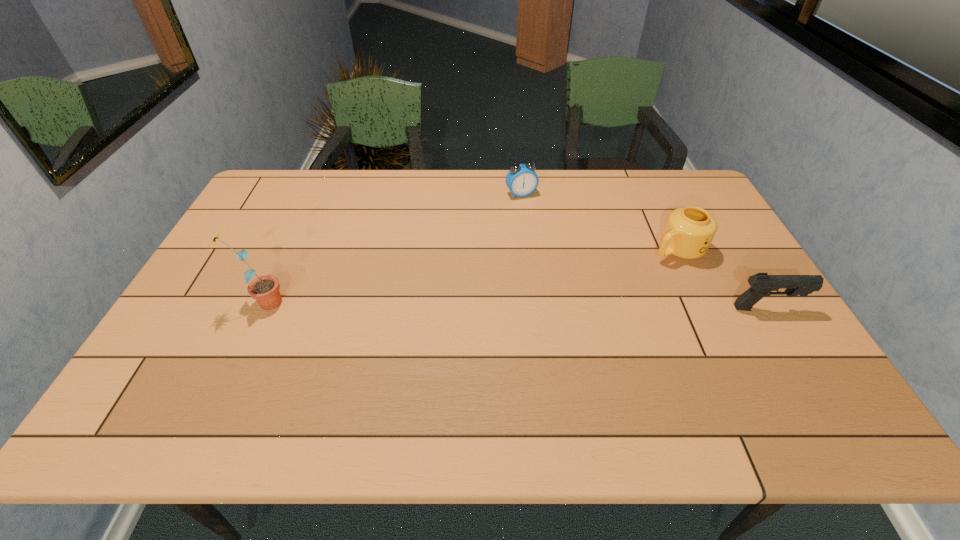
Where is `vacant space on the desktop that is between the leftmost object and the pistol and is positioned on the handle side of the third nearest object`? Image resolution: width=960 pixels, height=540 pixels. vacant space on the desktop that is between the leftmost object and the pistol and is positioned on the handle side of the third nearest object is located at coordinates (576, 306).

At what (x,y) coordinates should I click in order to perform the action: click on free space on the desktop that is between the leftmost object and the pistol and is positioned on the face of the alarm clock. Please return your answer as a coordinate pair (x, y). The width and height of the screenshot is (960, 540). Looking at the image, I should click on (588, 306).